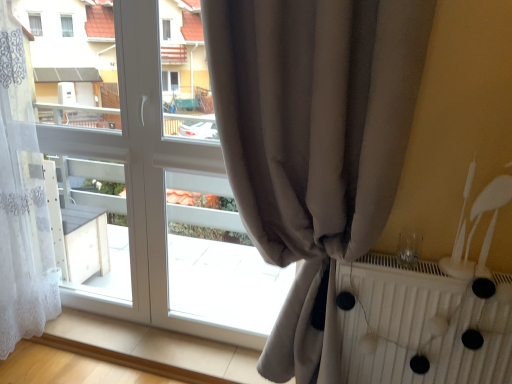
Question: Should I look upward or downward to see satin beige curtain at center, which is the first curtain in right-to-left order?

Choices:
 (A) up
 (B) down

Answer: (B)

Question: From the image's perspective, is satin beige curtain at center, which is the first curtain in right-to-left order, over white sheer curtain at left, which is counted as the 1th curtain, starting from the left?

Choices:
 (A) yes
 (B) no

Answer: (B)

Question: Is satin beige curtain at center, which is the first curtain in right-to-left order, closer to the viewer compared to white sheer curtain at left, placed as the 2th curtain when sorted from right to left?

Choices:
 (A) yes
 (B) no

Answer: (A)

Question: Is satin beige curtain at center, which is the first curtain in right-to-left order, oriented towards white sheer curtain at left, placed as the 2th curtain when sorted from right to left?

Choices:
 (A) yes
 (B) no

Answer: (B)

Question: Is satin beige curtain at center, placed as the second curtain when sorted from left to right, wider than white sheer curtain at left, which is counted as the 1th curtain, starting from the left?

Choices:
 (A) yes
 (B) no

Answer: (B)

Question: Does satin beige curtain at center, placed as the second curtain when sorted from left to right, have a smaller size compared to white sheer curtain at left, placed as the 2th curtain when sorted from right to left?

Choices:
 (A) no
 (B) yes

Answer: (B)

Question: Is white sheer curtain at left, placed as the 2th curtain when sorted from right to left, completely or partially inside satin beige curtain at center, placed as the second curtain when sorted from left to right?

Choices:
 (A) no
 (B) yes

Answer: (A)

Question: From a real-world perspective, is white sheer curtain at left, which is counted as the 1th curtain, starting from the left, positioned under satin beige curtain at center, which is the first curtain in right-to-left order, based on gravity?

Choices:
 (A) no
 (B) yes

Answer: (A)

Question: Is white sheer curtain at left, placed as the 2th curtain when sorted from right to left, closer to camera compared to satin beige curtain at center, which is the first curtain in right-to-left order?

Choices:
 (A) yes
 (B) no

Answer: (B)

Question: Can you confirm if white sheer curtain at left, which is counted as the 1th curtain, starting from the left, is smaller than satin beige curtain at center, placed as the second curtain when sorted from left to right?

Choices:
 (A) no
 (B) yes

Answer: (A)

Question: Can you confirm if white sheer curtain at left, placed as the 2th curtain when sorted from right to left, is positioned to the left of satin beige curtain at center, placed as the second curtain when sorted from left to right?

Choices:
 (A) yes
 (B) no

Answer: (A)

Question: From the image's perspective, would you say white sheer curtain at left, which is counted as the 1th curtain, starting from the left, is positioned over satin beige curtain at center, which is the first curtain in right-to-left order?

Choices:
 (A) yes
 (B) no

Answer: (A)

Question: Are white sheer curtain at left, which is counted as the 1th curtain, starting from the left, and satin beige curtain at center, which is the first curtain in right-to-left order, beside each other?

Choices:
 (A) yes
 (B) no

Answer: (B)

Question: Does satin beige curtain at center, which is the first curtain in right-to-left order, have a greater height compared to white textured radiator at right?

Choices:
 (A) yes
 (B) no

Answer: (A)